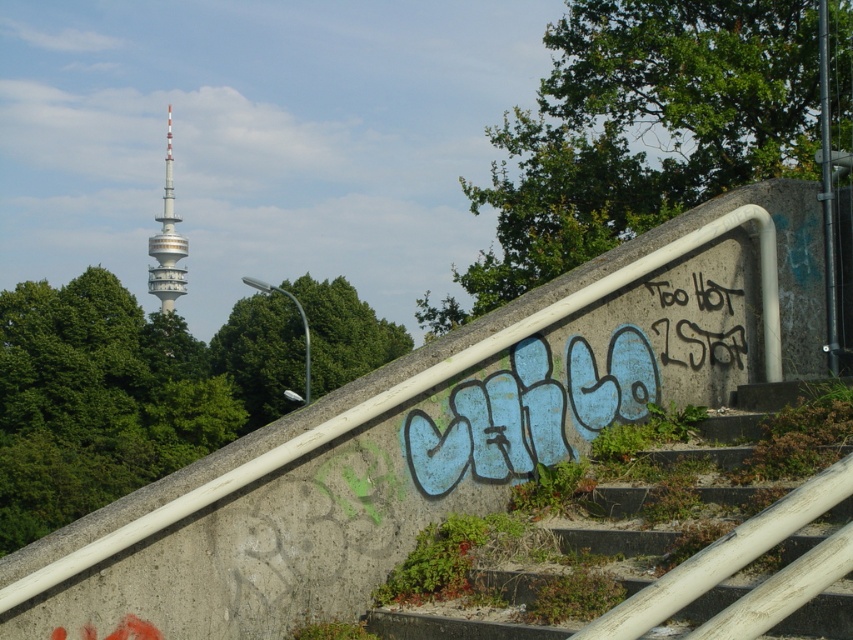
You are an architect evaluating the urban space. You need to determine if the concrete stairs at center can be seen from the base of the white concrete tower at upper left. Based on their heights, can you confirm visibility?

The concrete stairs at center is not as tall as the white concrete tower at upper left, so the stairs are shorter. Since the tower is taller, it might block the view from the base of the tower to the stairs. However, without knowing the exact distance and elevation, visibility cannot be definitively confirmed solely based on height comparison.

You are standing at the camera position looking at the scene. There is a point marked at coordinates point (682, 554). If you want to place a 3 meter wide banner exactly at that point, will it fit without overlapping other objects?

The point (682, 554) is 6.49 meters away from the camera. Since the banner is 3 meters wide, it can be placed there as there is enough space. However, ensure that the banner does not obstruct the view of the telecommunications tower or other key elements in the scene.

You are an artist planning to paint a mural on the wall between the black graffiti at upper right and the white concrete tower at upper left. Which object will your mural be closer to if you want it to be closer to the taller one?

The white concrete tower at upper left is taller than the black graffiti at upper right, so the mural will be closer to the white concrete tower at upper left if you want it to be near the taller object.